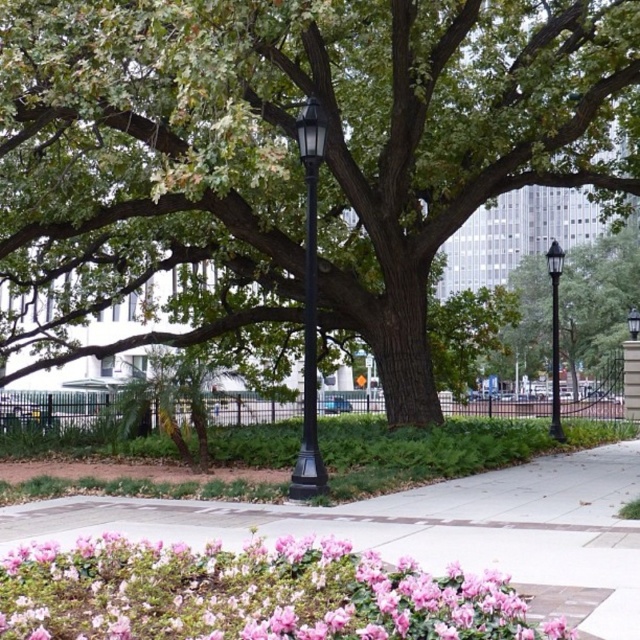
Question: Which object appears farthest from the camera in this image?

Choices:
 (A) black metal lamp post at center
 (B) green matte tree at center

Answer: (B)

Question: Which object is positioned farthest from the green matte tree at center?

Choices:
 (A) black metal lamp post at center
 (B) smooth concrete sidewalk at lower center
 (C) black glass lamp post at center

Answer: (C)

Question: Which object is positioned farthest from the black metal lamp post at center?

Choices:
 (A) green leafy tree at center
 (B) black glass lamp post at center
 (C) smooth concrete sidewalk at lower center

Answer: (B)

Question: Does green leafy tree at center have a greater width compared to black metal lamp post at center?

Choices:
 (A) yes
 (B) no

Answer: (A)

Question: Is pink matte flowers at lower left bigger than black metal lamp post at center?

Choices:
 (A) no
 (B) yes

Answer: (A)

Question: Where is green leafy tree at center located in relation to smooth concrete sidewalk at lower center in the image?

Choices:
 (A) right
 (B) left

Answer: (B)